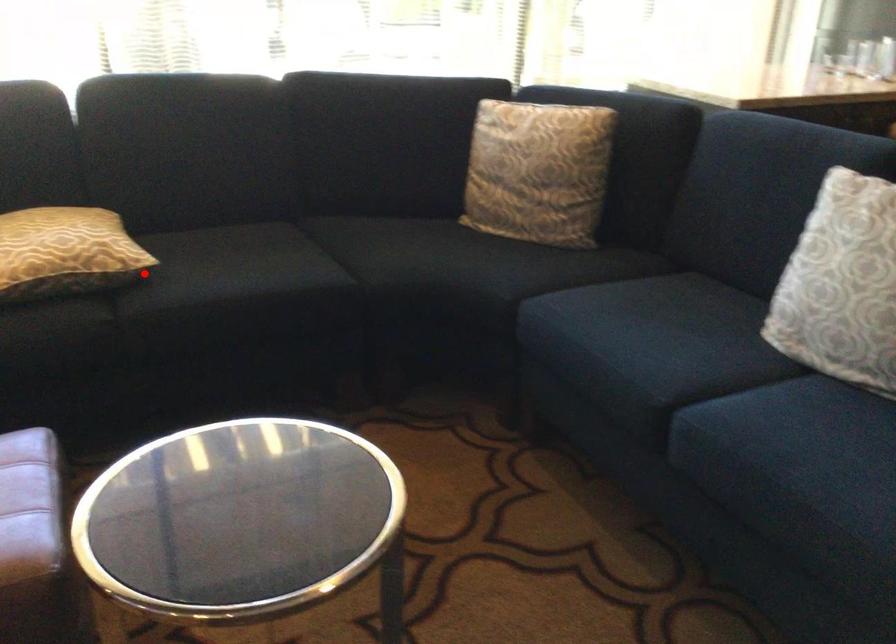
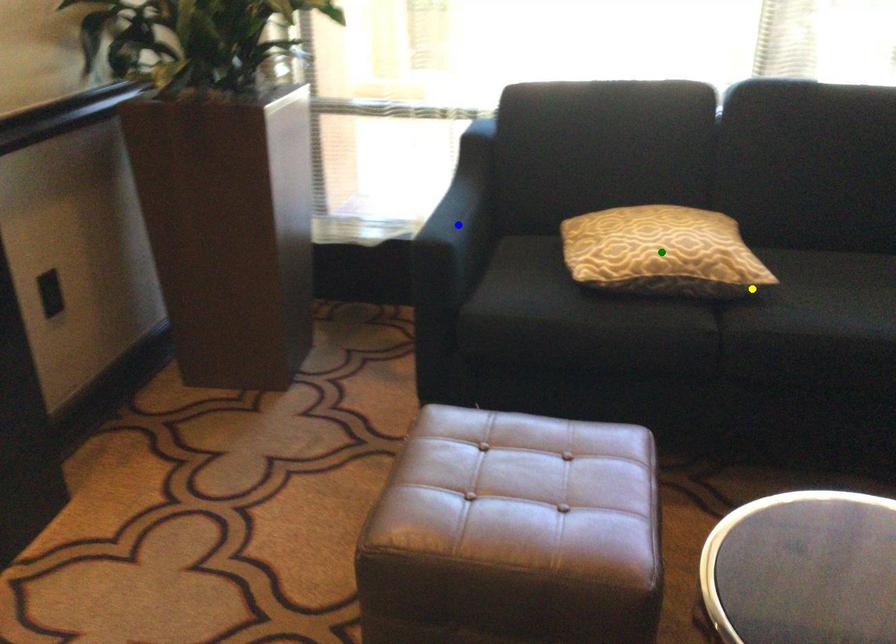
Question: I am providing you with two images of the same scene from different viewpoints. A red point is marked on the first image. You are given multiple points on the second image. Which point in image 2 represents the same 3d spot as the red point in image 1?

Choices:
 (A) blue point
 (B) yellow point
 (C) green point

Answer: (B)